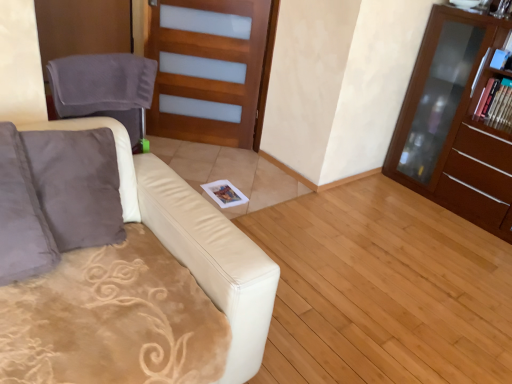
Question: Should I look upward or downward to see blue glossy book at upper right?

Choices:
 (A) down
 (B) up

Answer: (B)

Question: From a real-world perspective, is brown wood cabinet at right beneath light brown wood at center?

Choices:
 (A) no
 (B) yes

Answer: (A)

Question: From a real-world perspective, is brown wood cabinet at right physically above light brown wood at center?

Choices:
 (A) yes
 (B) no

Answer: (A)

Question: From the image's perspective, would you say brown wood cabinet at right is positioned over light brown wood at center?

Choices:
 (A) no
 (B) yes

Answer: (B)

Question: Is brown wood cabinet at right closer to camera compared to light brown wood at center?

Choices:
 (A) no
 (B) yes

Answer: (A)

Question: Is brown wood cabinet at right bigger than light brown wood at center?

Choices:
 (A) no
 (B) yes

Answer: (B)

Question: From the image's perspective, is brown wood cabinet at right located beneath light brown wood at center?

Choices:
 (A) no
 (B) yes

Answer: (A)

Question: Is the depth of brown wood cabinet at right less than that of gray fabric swivel chair at left?

Choices:
 (A) no
 (B) yes

Answer: (A)

Question: Does brown wood cabinet at right turn towards gray fabric swivel chair at left?

Choices:
 (A) no
 (B) yes

Answer: (B)

Question: Considering the relative sizes of brown wood cabinet at right and gray fabric swivel chair at left in the image provided, is brown wood cabinet at right bigger than gray fabric swivel chair at left?

Choices:
 (A) yes
 (B) no

Answer: (A)

Question: Could gray fabric swivel chair at left be considered to be inside brown wood cabinet at right?

Choices:
 (A) yes
 (B) no

Answer: (B)

Question: Is brown wood cabinet at right wider than gray fabric swivel chair at left?

Choices:
 (A) no
 (B) yes

Answer: (B)

Question: Is the depth of brown wood cabinet at right greater than that of gray fabric swivel chair at left?

Choices:
 (A) yes
 (B) no

Answer: (A)

Question: Is light brown wood at center wider than brown wood cabinet at right?

Choices:
 (A) yes
 (B) no

Answer: (A)